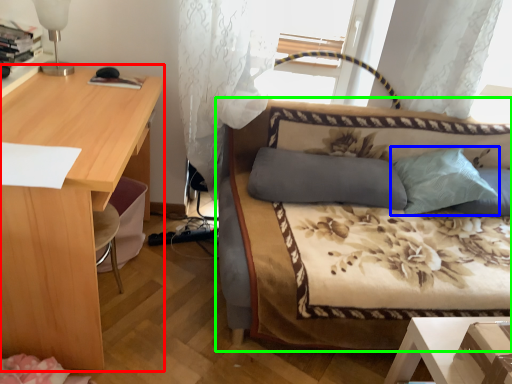
Question: Which object is positioned closest to desk (highlighted by a red box)? Select from pillow (highlighted by a blue box) and studio couch (highlighted by a green box).

Choices:
 (A) pillow
 (B) studio couch

Answer: (B)